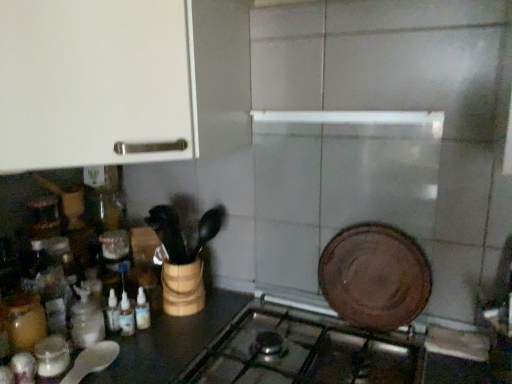
At what (x,y) coordinates should I click in order to perform the action: click on vacant area situated to the left side of brown matte plate at upper right. Please return your answer as a coordinate pair (x, y). The height and width of the screenshot is (384, 512). Looking at the image, I should click on (303, 329).